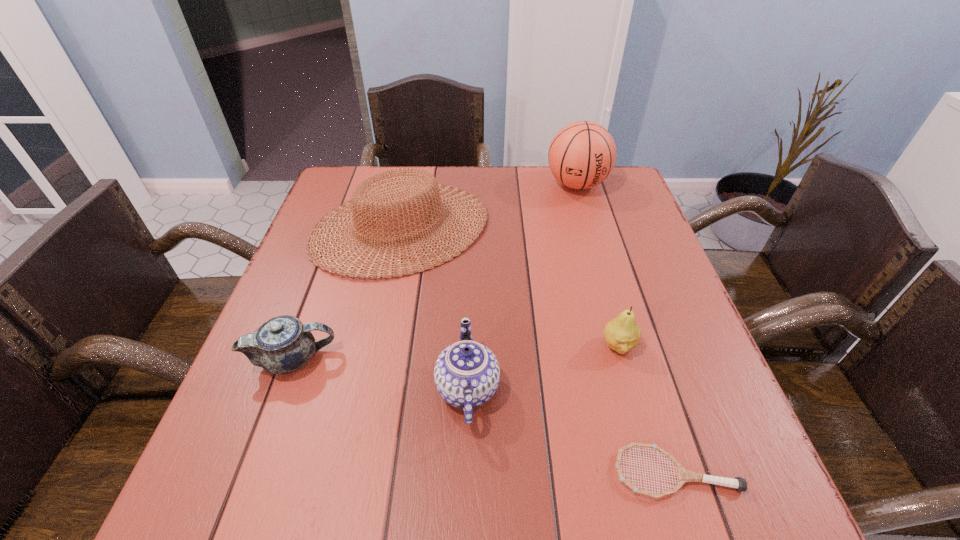
Where is `object that ranks as the fourth closest to the pear`? object that ranks as the fourth closest to the pear is located at coordinates (582, 154).

Locate an element on the screen. vacant space that satisfies the following two spatial constraints: 1. on the back side of the shortest object; 2. at the spout of the right chinaware is located at coordinates (649, 388).

Identify the location of free spot that satisfies the following two spatial constraints: 1. on the surface of the basketball near the brand logo; 2. at the spout of the right chinaware. The image size is (960, 540). tap(636, 388).

This screenshot has height=540, width=960. What are the coordinates of `blank space that satisfies the following two spatial constraints: 1. on the front side of the shortest object; 2. on the left side of the pear` in the screenshot? It's located at (655, 472).

What are the coordinates of `free space that satisfies the following two spatial constraints: 1. on the front side of the sunhat; 2. on the left side of the pear` in the screenshot? It's located at (375, 346).

Where is `free location that satisfies the following two spatial constraints: 1. on the front side of the pear; 2. at the spout of the right chinaware`? The width and height of the screenshot is (960, 540). free location that satisfies the following two spatial constraints: 1. on the front side of the pear; 2. at the spout of the right chinaware is located at coordinates (631, 388).